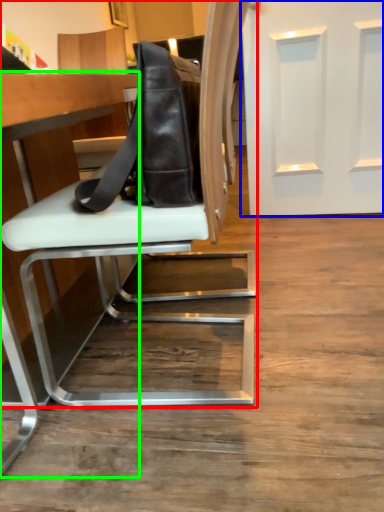
Question: Which object is positioned closest to chair (highlighted by a red box)? Select from door (highlighted by a blue box) and table (highlighted by a green box).

Choices:
 (A) door
 (B) table

Answer: (B)